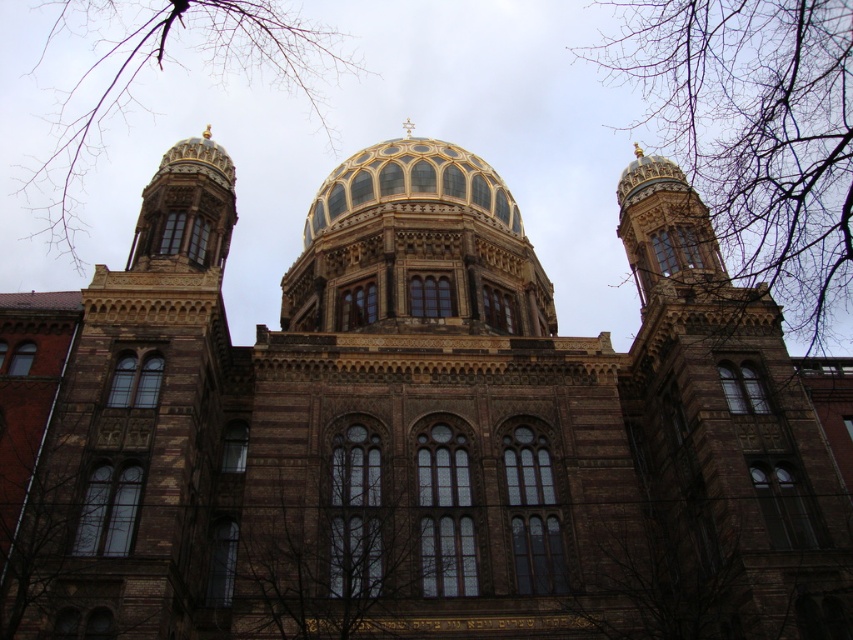
Who is shorter, bare branches at upper center or bare branches at upper left?

With less height is bare branches at upper left.

Can you confirm if bare branches at upper center is smaller than bare branches at upper left?

Indeed, bare branches at upper center has a smaller size compared to bare branches at upper left.

Between point (746, 144) and point (32, 164), which one is positioned in front?

Point (746, 144) is in front.

What are the coordinates of `bare branches at upper center` in the screenshot? It's located at (755, 132).

Looking at this image, who is shorter, bare branches at upper left or gold/glass dome at center?

With less height is gold/glass dome at center.

Who is more forward, (254, 19) or (473, 160)?

Point (473, 160) is more forward.

Who is more distant from viewer, (57, 164) or (347, 179)?

Point (57, 164)

Find the location of a particular element. bare branches at upper left is located at coordinates (161, 70).

Can you confirm if bare branches at upper center is thinner than gold/glass dome at center?

No.

Measure the distance between bare branches at upper center and gold/glass dome at center.

124.01 feet

Who is more distant from viewer, (776, 284) or (383, 173)?

The point (776, 284) is behind.

At what (x,y) coordinates should I click in order to perform the action: click on bare branches at upper center. Please return your answer as a coordinate pair (x, y). The width and height of the screenshot is (853, 640). Looking at the image, I should click on (755, 132).